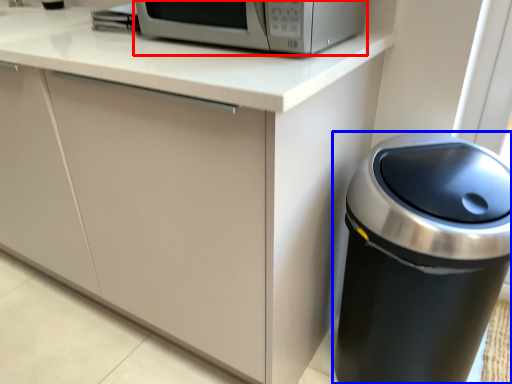
Question: Which object appears farthest to the camera in this image, home appliance (highlighted by a red box) or waste container (highlighted by a blue box)?

Choices:
 (A) home appliance
 (B) waste container

Answer: (A)